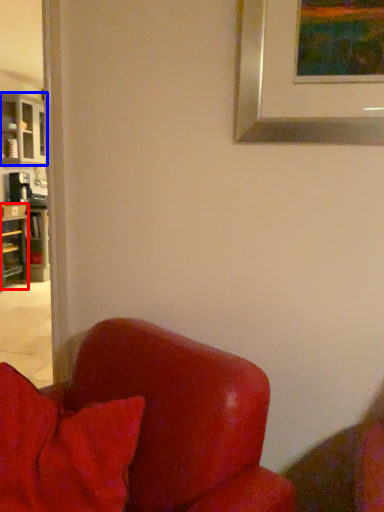
Question: Which of the following is the farthest to the observer, shelf (highlighted by a red box) or cabinetry (highlighted by a blue box)?

Choices:
 (A) shelf
 (B) cabinetry

Answer: (B)